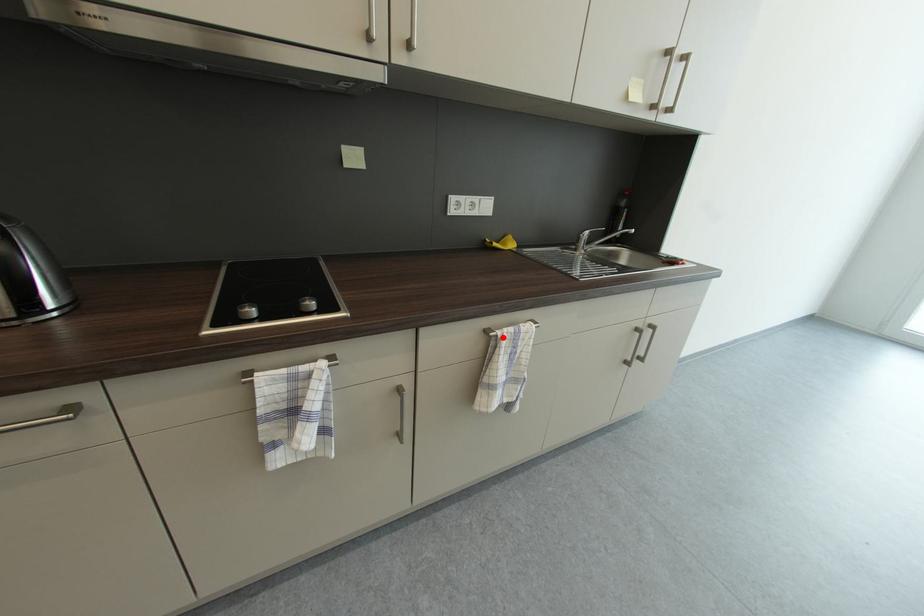
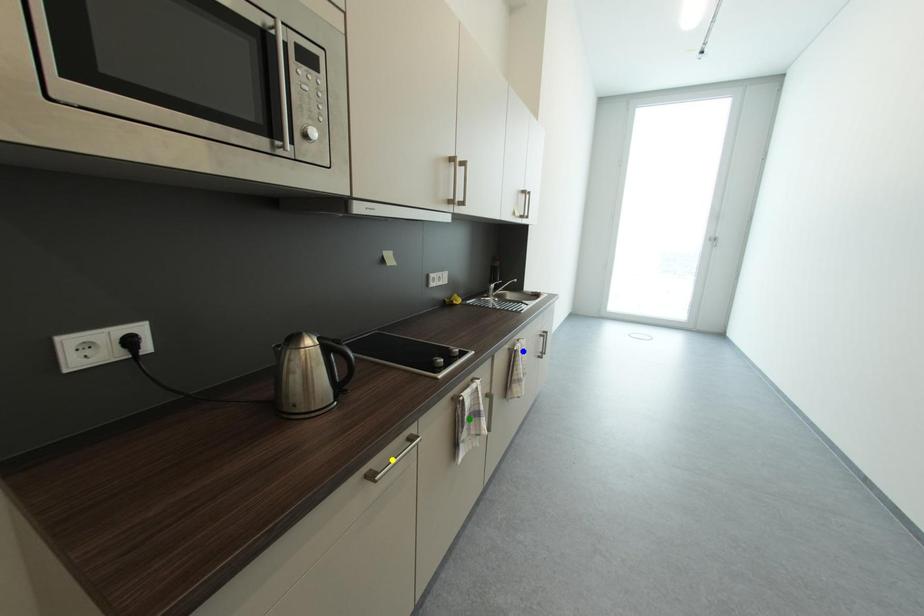
Question: I am providing you with two images of the same scene from different viewpoints. A red point is marked on the first image. You are given multiple points on the second image. Which mark in image 2 goes with the point in image 1?

Choices:
 (A) blue point
 (B) green point
 (C) yellow point

Answer: (A)